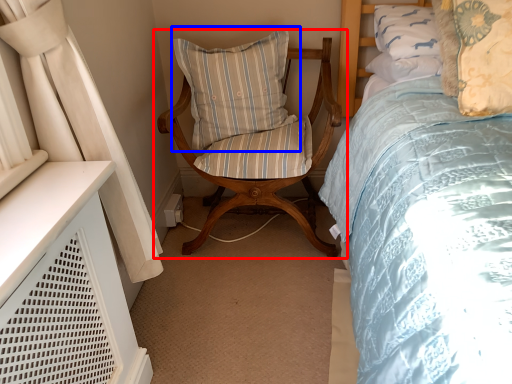
Question: Which object is closer to the camera taking this photo, chair (highlighted by a red box) or pillow (highlighted by a blue box)?

Choices:
 (A) chair
 (B) pillow

Answer: (A)